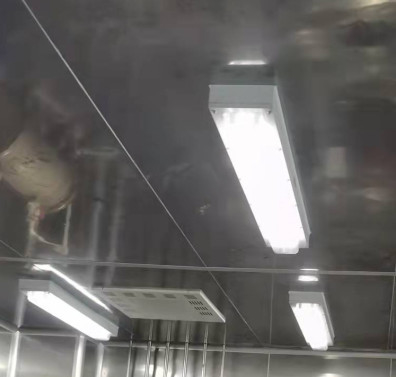
Find the location of `vent`. vent is located at coordinates (186, 312).